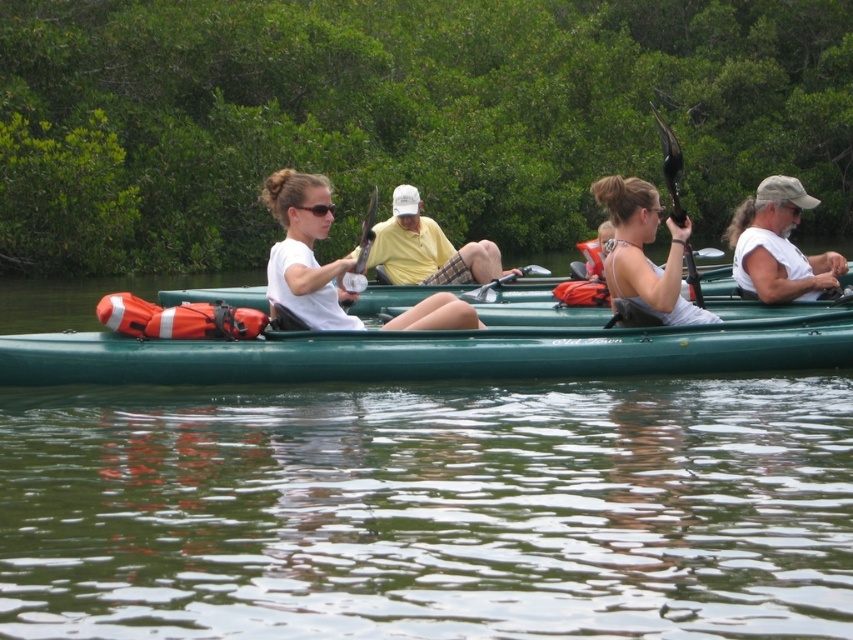
Question: Which point is farther from the camera taking this photo?

Choices:
 (A) (125, 496)
 (B) (433, 230)
 (C) (149, 362)

Answer: (B)

Question: Which point is closer to the camera?

Choices:
 (A) (397, 224)
 (B) (35, 353)
 (C) (764, 259)

Answer: (B)

Question: Is green plastic kayak at center to the right of yellow cotton shirt at center from the viewer's perspective?

Choices:
 (A) yes
 (B) no

Answer: (B)

Question: Based on their relative distances, which object is nearer to the white matte kayak at center?

Choices:
 (A) white fabric tank top at center
 (B) black plastic paddle at upper right
 (C) green smooth water at lower center

Answer: (A)

Question: Where is green smooth water at lower center located in relation to black plastic paddle at upper right in the image?

Choices:
 (A) left
 (B) right

Answer: (A)

Question: Is yellow cotton shirt at center above black plastic paddle at upper right?

Choices:
 (A) no
 (B) yes

Answer: (A)